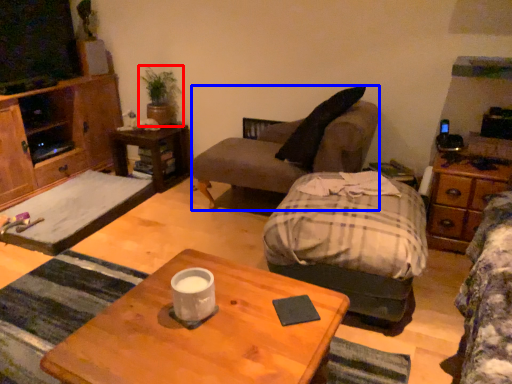
Question: Among these objects, which one is nearest to the camera, houseplant (highlighted by a red box) or studio couch (highlighted by a blue box)?

Choices:
 (A) houseplant
 (B) studio couch

Answer: (B)